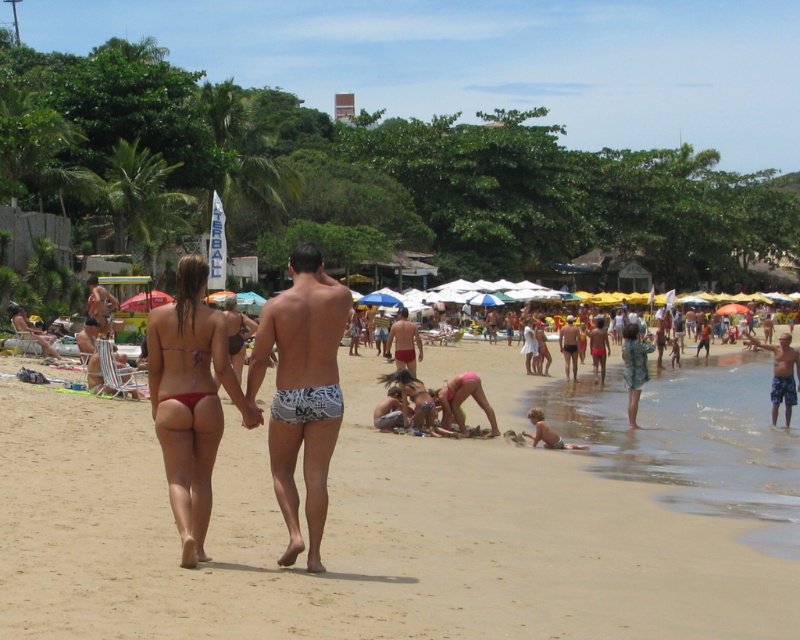
Question: Which point is closer to the camera?

Choices:
 (A) (790, 406)
 (B) (636, 342)
 (C) (390, 497)
 (D) (318, 371)

Answer: (D)

Question: Considering the real-world distances, which object is farthest from the blue plaid shorts at lower right?

Choices:
 (A) white printed swim trunks at center
 (B) floral print dress at lower right
 (C) pink fabric bikini at lower center
 (D) matte pink bikini at center

Answer: (A)

Question: Can you confirm if pink fabric bikini at lower center is positioned to the right of floral print dress at lower right?

Choices:
 (A) yes
 (B) no

Answer: (B)

Question: Does matte bikini at center have a larger size compared to floral print dress at lower right?

Choices:
 (A) no
 (B) yes

Answer: (B)

Question: Is the position of matte bikini at center more distant than that of pink fabric bikini at lower center?

Choices:
 (A) no
 (B) yes

Answer: (A)

Question: Which point is farther from the camera taking this photo?

Choices:
 (A) (236, 314)
 (B) (648, 346)

Answer: (B)